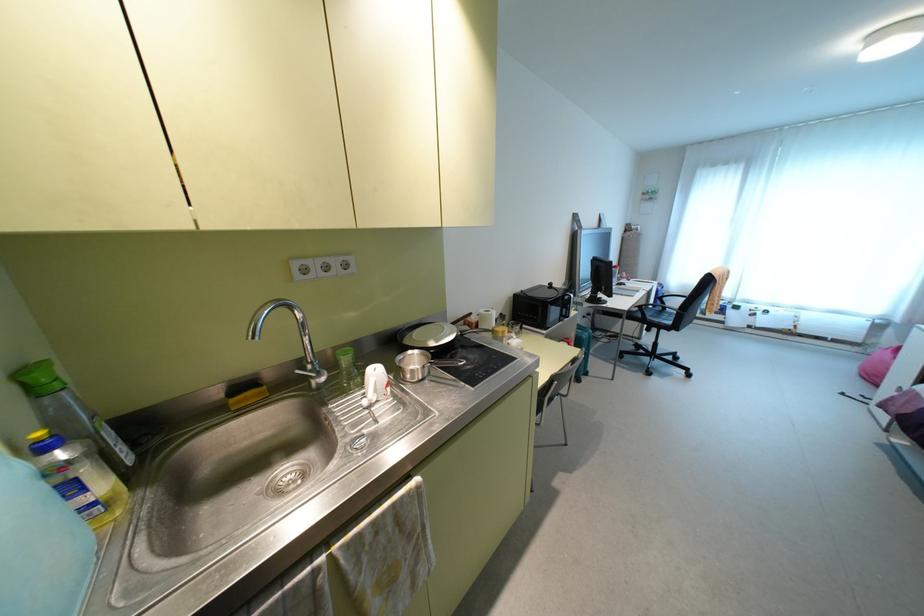
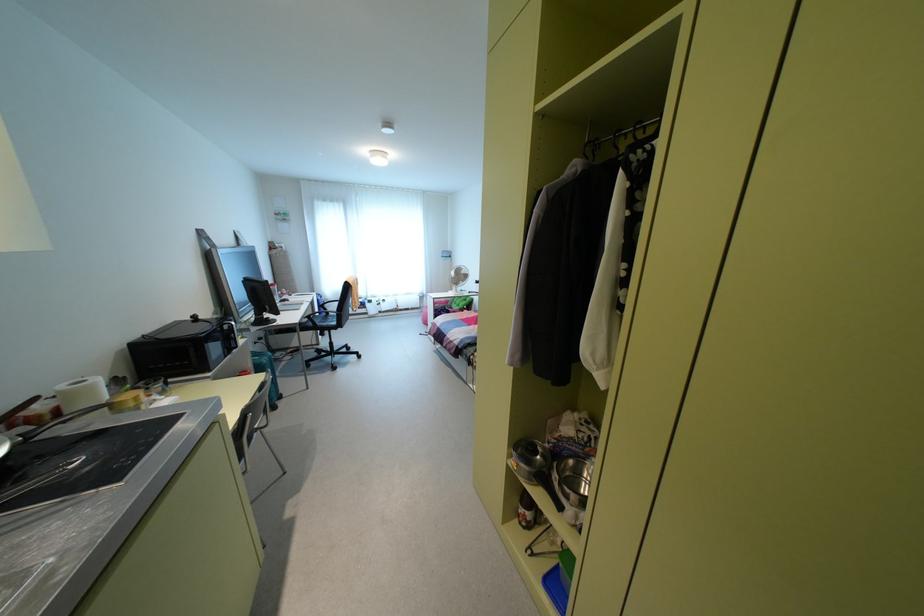
Where in the second image is the point corresponding to point 564,315 from the first image?

(229, 346)